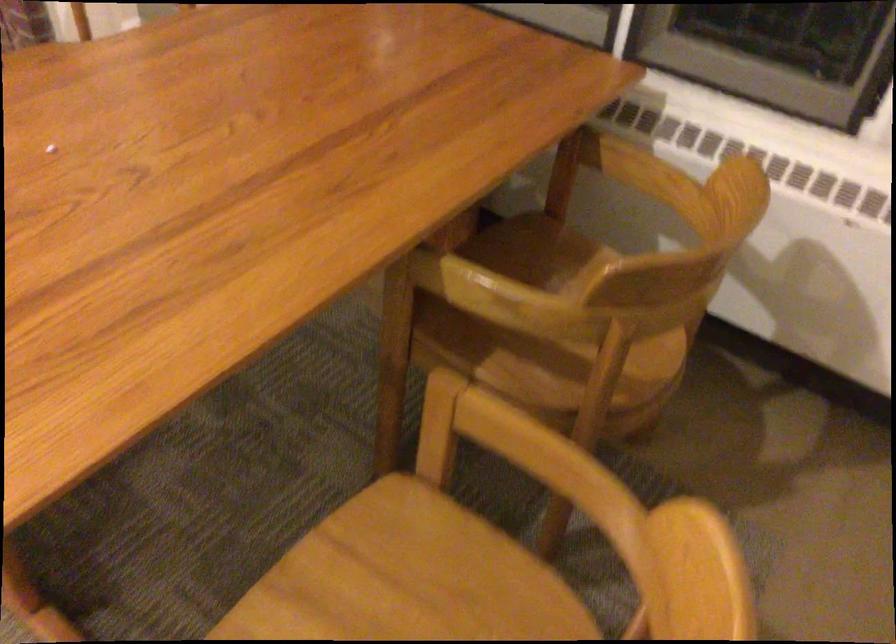
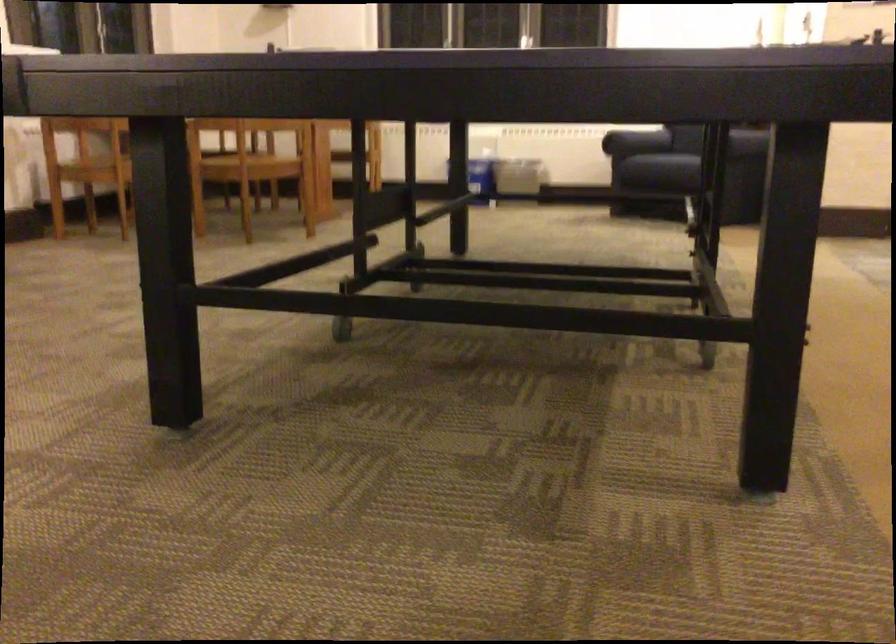
Question: I am providing you with two images of the same scene from different viewpoints. Please identify which objects are invisible in image2.

Choices:
 (A) dark-covered book
 (B) chair sitting surface
 (C) wooden chair armrest
 (D) sofa armrest

Answer: (C)